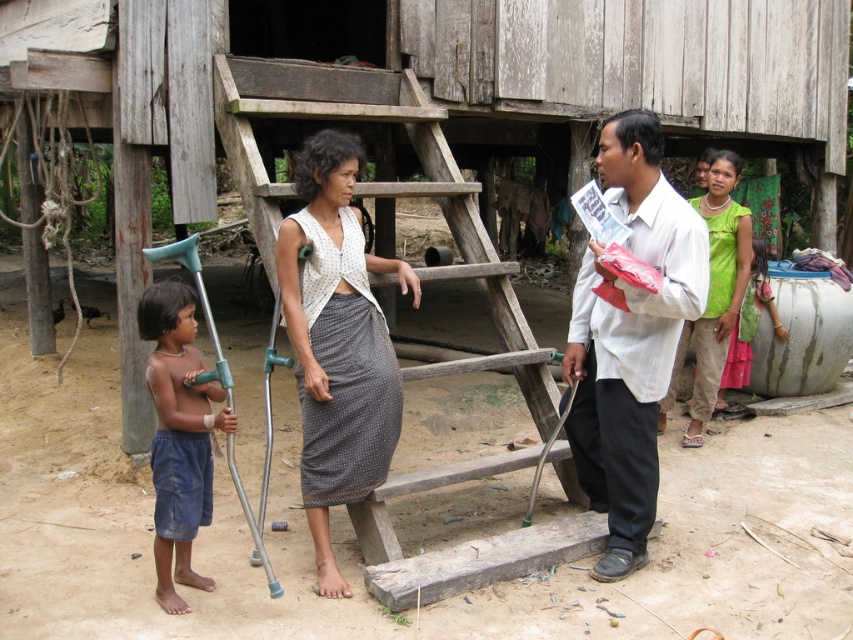
Question: Can you confirm if wooden at center is wider than green fabric top at upper right?

Choices:
 (A) no
 (B) yes

Answer: (B)

Question: Is wooden at center further to camera compared to white knitted vest at center?

Choices:
 (A) no
 (B) yes

Answer: (B)

Question: Which of the following is the closest to the observer?

Choices:
 (A) (392, 348)
 (B) (711, 342)
 (C) (177, 320)
 (D) (231, 134)

Answer: (C)

Question: Can you confirm if wooden at center is positioned to the right of white knitted vest at center?

Choices:
 (A) yes
 (B) no

Answer: (A)

Question: Estimate the real-world distances between objects in this image. Which object is farther from the blue denim shorts at lower left?

Choices:
 (A) white knitted vest at center
 (B) green fabric top at upper right

Answer: (B)

Question: Among these points, which one is farthest from the camera?

Choices:
 (A) (737, 173)
 (B) (334, 346)

Answer: (A)